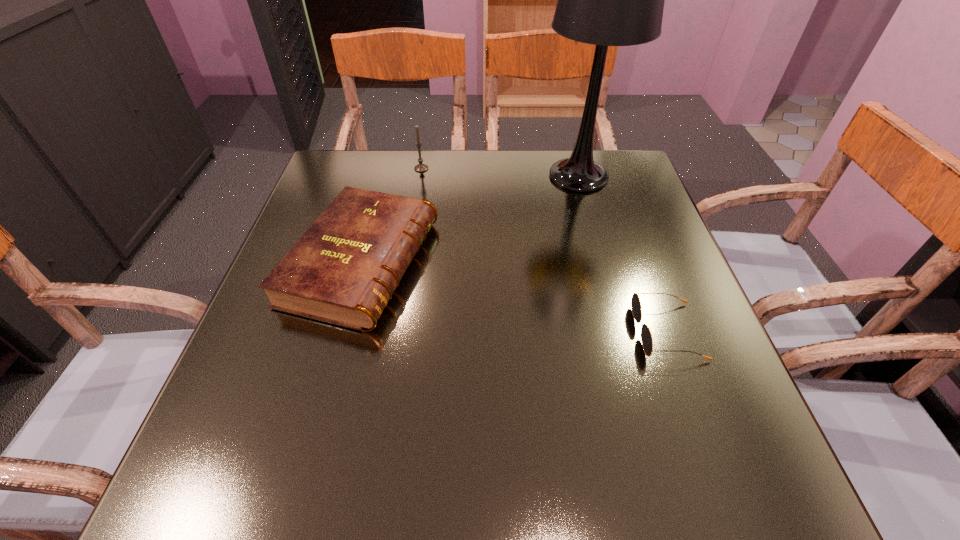
Find the location of `vacant area that lies between the candle and the sunglasses`. vacant area that lies between the candle and the sunglasses is located at coordinates (544, 250).

Identify the location of free space between the sunglasses and the candle. The image size is (960, 540). (544, 250).

Where is `vacant space that's between the hardback book and the shortest object`? The height and width of the screenshot is (540, 960). vacant space that's between the hardback book and the shortest object is located at coordinates click(515, 297).

Select which object is the closest to the shortest object. Please provide its 2D coordinates. Your answer should be formatted as a tuple, i.e. [(x, y)], where the tuple contains the x and y coordinates of a point satisfying the conditions above.

[(606, 0)]

Find the location of `object that is the second closest one to the sunglasses`. object that is the second closest one to the sunglasses is located at coordinates (344, 269).